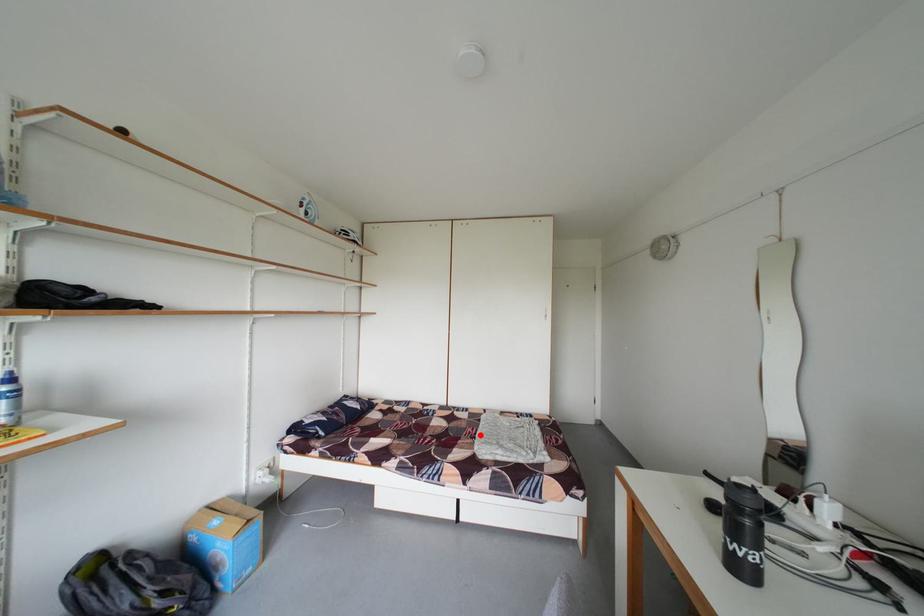
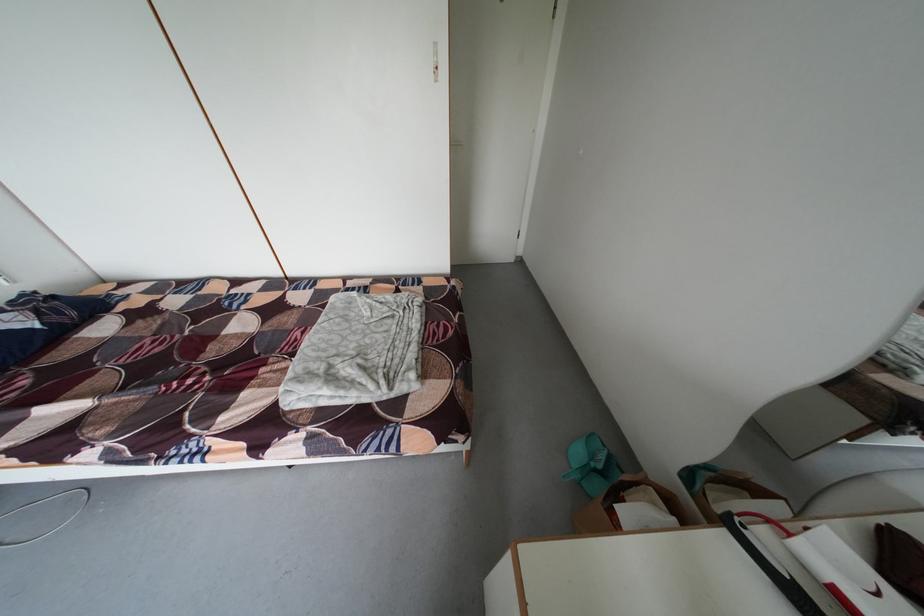
Question: A red point is marked in image1. In image2, is the corresponding 3D point closer to the camera or farther? Reply with the corresponding letter.

Choices:
 (A) The corresponding 3D point is closer.
 (B) The corresponding 3D point is farther.

Answer: (B)